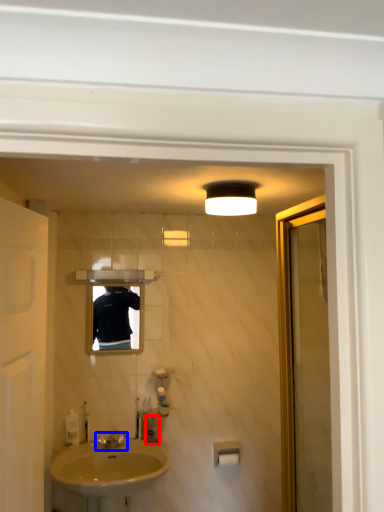
Question: Which of the following is the closest to the observer, toiletry (highlighted by a red box) or tap (highlighted by a blue box)?

Choices:
 (A) toiletry
 (B) tap

Answer: (B)